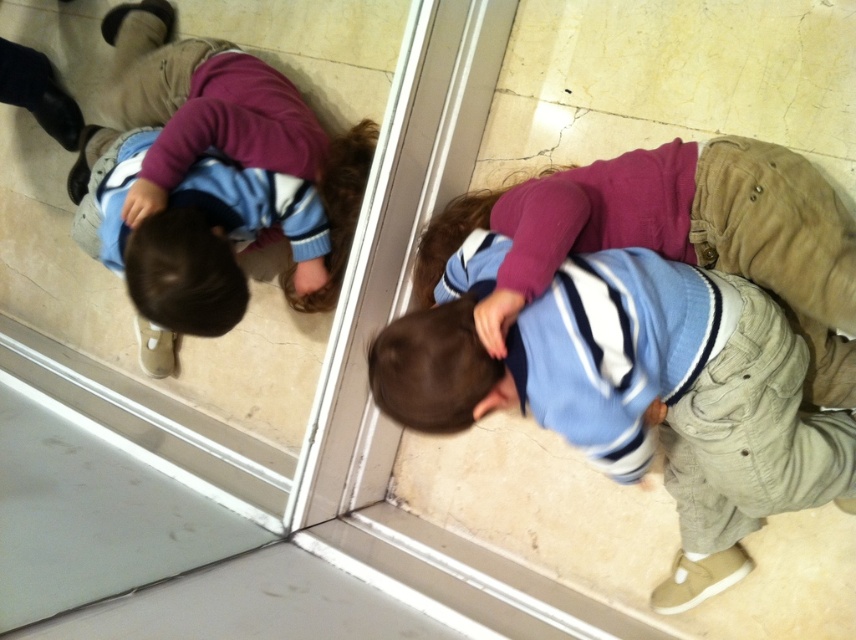
This screenshot has height=640, width=856. What do you see at coordinates (218, 403) in the screenshot? I see `transparent glass door at center` at bounding box center [218, 403].

Which is in front, point (10, 388) or point (810, 184)?

Positioned in front is point (810, 184).

Between point (314, 621) and point (720, 234), which one is positioned in front?

Point (720, 234)

Where is `transparent glass door at center`? This screenshot has width=856, height=640. transparent glass door at center is located at coordinates (218, 403).

I want to click on matte blue sweater at lower center, so click(x=635, y=392).

Is matte blue sweater at lower center to the right of matte blue sweater at center from the viewer's perspective?

In fact, matte blue sweater at lower center is to the left of matte blue sweater at center.

Between point (415, 330) and point (617, 225), which one is positioned behind?

Point (617, 225)

Locate an element on the screen. matte blue sweater at lower center is located at coordinates (635, 392).

Does transparent glass door at center appear on the right side of matte blue sweater at lower center?

Incorrect, transparent glass door at center is not on the right side of matte blue sweater at lower center.

Between point (465, 161) and point (407, 353), which one is positioned in front?

Point (407, 353) is more forward.

Locate an element on the screen. transparent glass door at center is located at coordinates (218, 403).